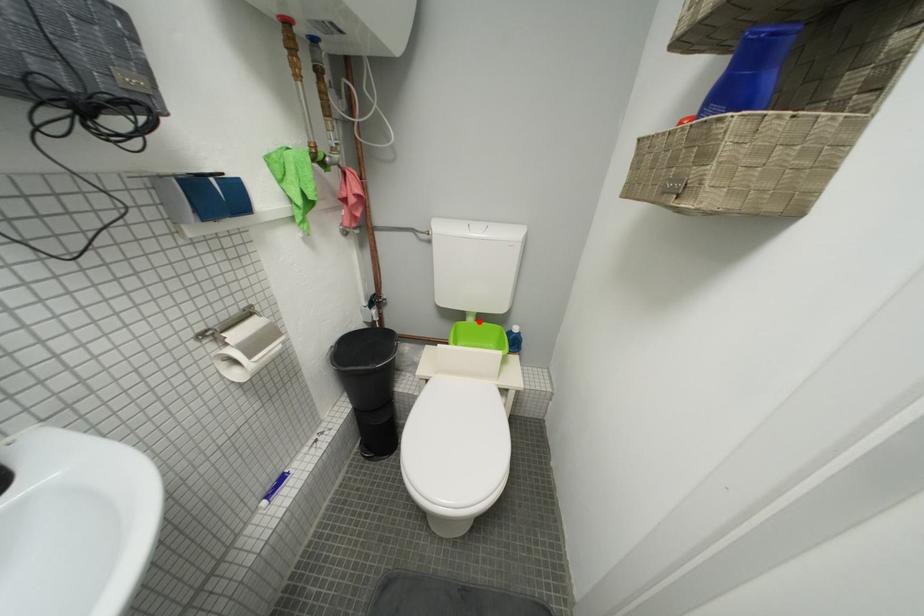
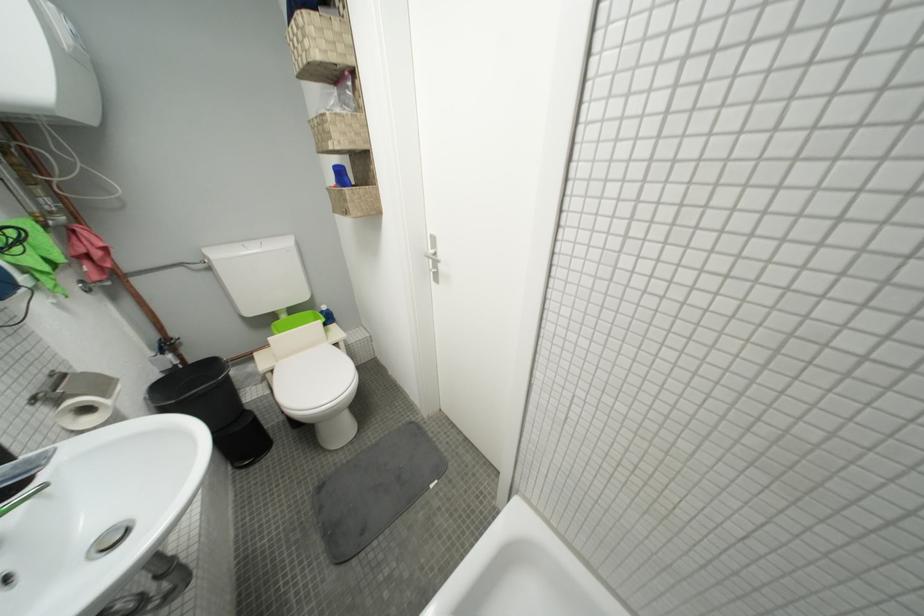
Question: I am providing you with two images of the same scene from different viewpoints. Given a red point in image1, look at the same physical point in image2. Is it:

Choices:
 (A) Closer to the viewpoint
 (B) Farther from the viewpoint

Answer: (A)